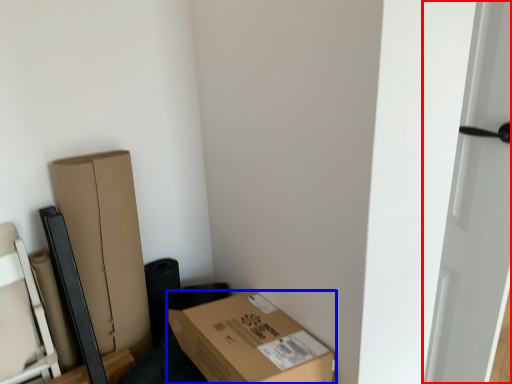
Question: Which of the following is the closest to the observer, door (highlighted by a red box) or box (highlighted by a blue box)?

Choices:
 (A) door
 (B) box

Answer: (A)